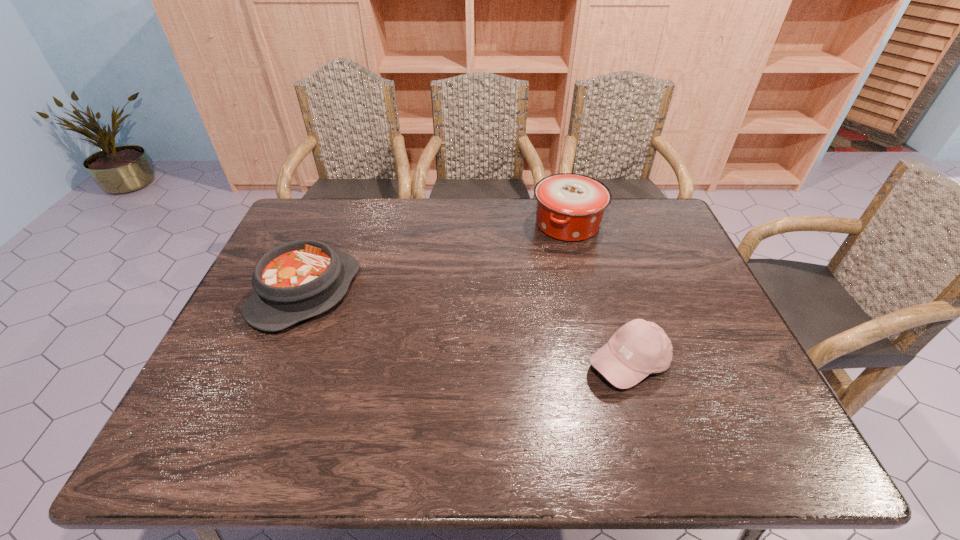
I want to click on blank space at the far edge of the desktop, so click(492, 198).

Locate an element on the screen. free location at the near edge is located at coordinates (348, 431).

The width and height of the screenshot is (960, 540). In the image, there is a desktop. What are the coordinates of `vacant space at the far left corner` in the screenshot? It's located at (325, 234).

Locate an element on the screen. Image resolution: width=960 pixels, height=540 pixels. free space at the far right corner of the desktop is located at coordinates (636, 200).

Where is `vacant region at the near right corner of the desktop`? The width and height of the screenshot is (960, 540). vacant region at the near right corner of the desktop is located at coordinates (727, 423).

The height and width of the screenshot is (540, 960). Identify the location of free area in between the taller casserole and the left casserole. (437, 259).

The width and height of the screenshot is (960, 540). Identify the location of vacant area that lies between the left casserole and the baseball cap. (468, 328).

Image resolution: width=960 pixels, height=540 pixels. What are the coordinates of `vacant space that's between the right casserole and the baseball cap` in the screenshot? It's located at (598, 294).

Where is `unoccupied area between the baseball cap and the shorter casserole`? unoccupied area between the baseball cap and the shorter casserole is located at coordinates (468, 328).

Identify the location of unoccupied area between the taller casserole and the baseball cap. (598, 294).